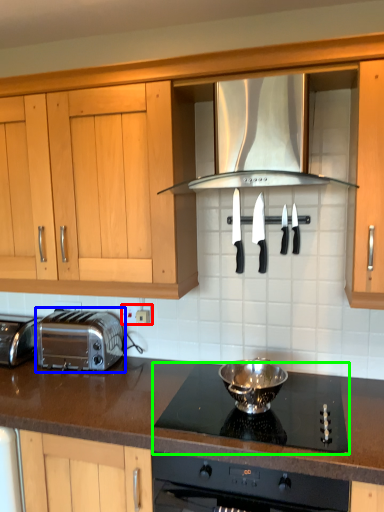
Question: Considering the real-world distances, which object is closest to electric outlet (highlighted by a red box)? toaster (highlighted by a blue box) or gas stove (highlighted by a green box).

Choices:
 (A) toaster
 (B) gas stove

Answer: (A)